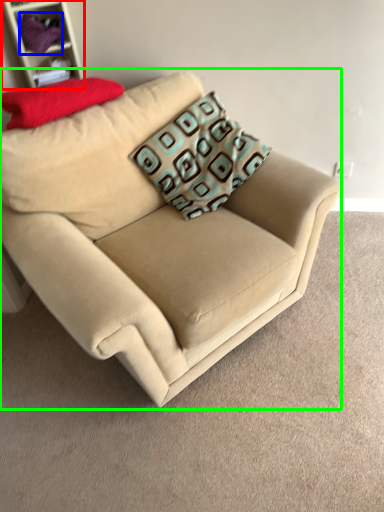
Question: Based on their relative distances, which object is farther from shelf (highlighted by a red box)? Choose from fabric (highlighted by a blue box) and studio couch (highlighted by a green box).

Choices:
 (A) fabric
 (B) studio couch

Answer: (B)